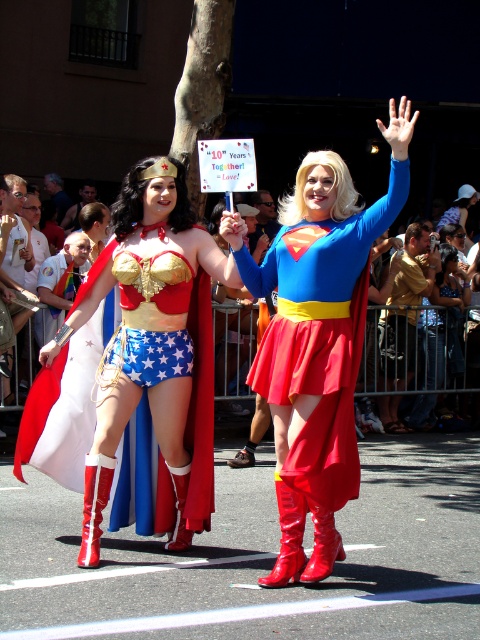
You are a photographer trying to capture a closeup shot of the Wonder Woman character. You have a camera with a zoom lens that can focus on objects within a 0.3 unit radius. You see two points in the scene marked as point 1 at coordinates point (x=357, y=349) and point 2 at coordinates point (x=141, y=177). Which point should you focus on to ensure the Wonder Woman character is in focus?

Point 1 at coordinates point (x=357, y=349) is closer to the camera than point 2 at coordinates point (x=141, y=177). Therefore, focusing on point 1 at coordinates point (x=357, y=349) will ensure the Wonder Woman character is in focus since it is nearer to the camera.

You are a photographer at the superhero parade. You want to take a photo of both the shiny red boots at center and the shiny metallic cape at center. Can you see both objects clearly in the same frame?

The shiny red boots at center is in front of the shiny metallic cape at center, so the cape might be partially obscured by the boots in the photo. Adjust your angle to ensure both are visible.